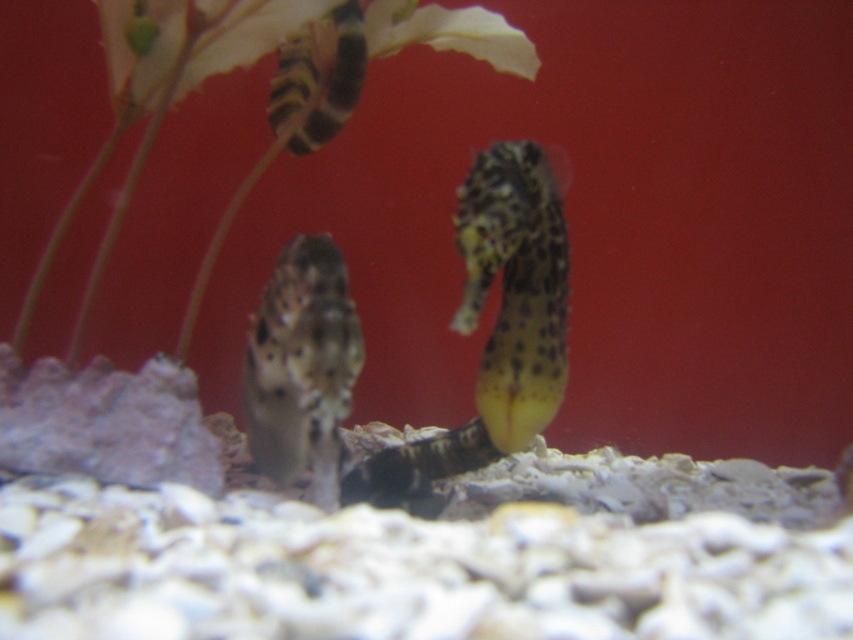
Is point (161, 86) less distant than point (498, 387)?

No, (161, 86) is behind (498, 387).

Can you confirm if green leafy plant at upper center is positioned to the left of spotted seahorse at center?

Correct, you'll find green leafy plant at upper center to the left of spotted seahorse at center.

Identify the location of green leafy plant at upper center. (x=270, y=90).

Which is below, green leafy plant at upper center or speckled seahorse at center?

speckled seahorse at center is lower down.

Which is more to the right, green leafy plant at upper center or speckled seahorse at center?

Positioned to the right is speckled seahorse at center.

Describe the element at coordinates (270, 90) in the screenshot. Image resolution: width=853 pixels, height=640 pixels. I see `green leafy plant at upper center` at that location.

Find the location of a particular element. green leafy plant at upper center is located at coordinates (270, 90).

Based on the photo, is spotted seahorse at center thinner than speckled seahorse at center?

Incorrect, spotted seahorse at center's width is not less than speckled seahorse at center's.

Is point (508, 362) positioned after point (337, 308)?

Yes, it is.

Image resolution: width=853 pixels, height=640 pixels. I want to click on spotted seahorse at center, so click(x=492, y=326).